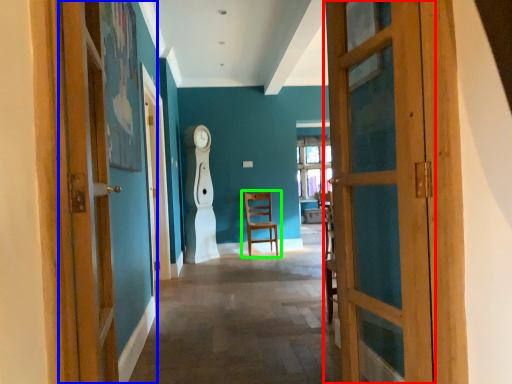
Question: Which is farther away from door (highlighted by a red box)? door (highlighted by a blue box) or chair (highlighted by a green box)?

Choices:
 (A) door
 (B) chair

Answer: (B)